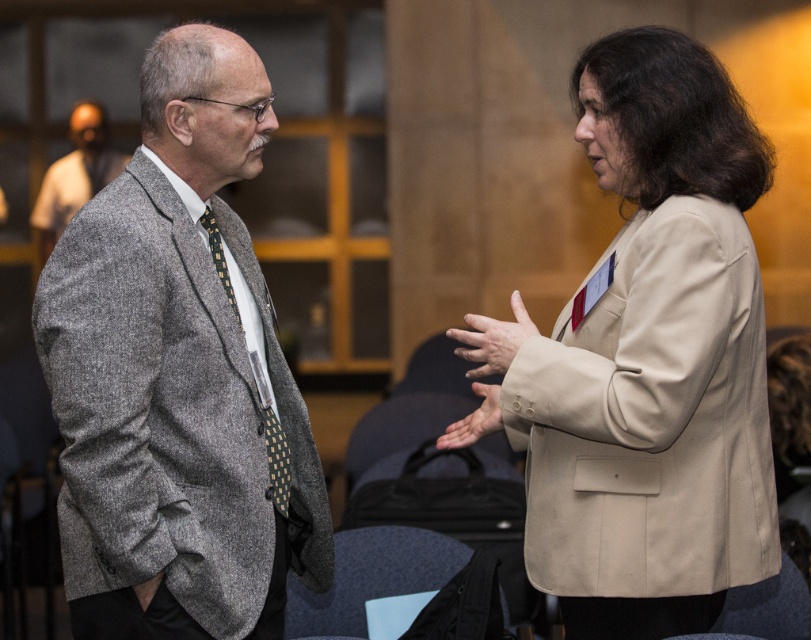
You are an event organizer at a formal conference. You need to arrange seating for two attendees based on their attire. The gray woolen suit at left and the green dotted tie at center are part of their outfits. According to the seating chart, attendees with items above others should sit closer to the front. Which attendee should be seated closer to the front?

The gray woolen suit at left is above the green dotted tie at center, so the attendee wearing the gray woolen suit at left should be seated closer to the front.

You are a photographer setting up for a group photo. You notice the gray woolen suit at left and the smooth beige hand at center in the frame. To ensure both are clearly visible, what is the minimum distance you should maintain between the camera and the subjects?

The gray woolen suit at left is 24.45 inches from the smooth beige hand at center. To ensure both are clearly visible in focus, the minimum distance should be at least 24.45 inches from the camera to the nearest subject.

You are an event coordinator observing a conference. You notice a gray woolen suit at left and a smooth beige hand at center. Which object is positioned higher in the image?

The gray woolen suit at left is taller than the smooth beige hand at center, so the gray woolen suit at left is positioned higher in the image.